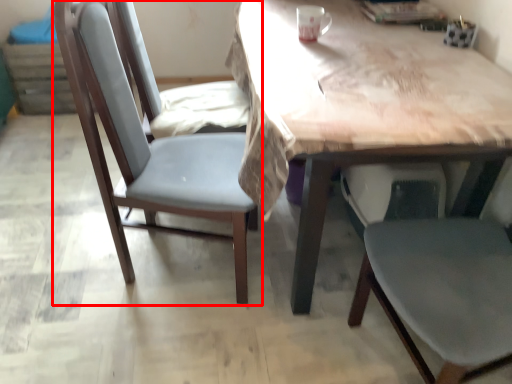
Question: From the image, what is the correct spatial relationship of chair (annotated by the red box) in relation to table?

Choices:
 (A) left
 (B) right

Answer: (A)